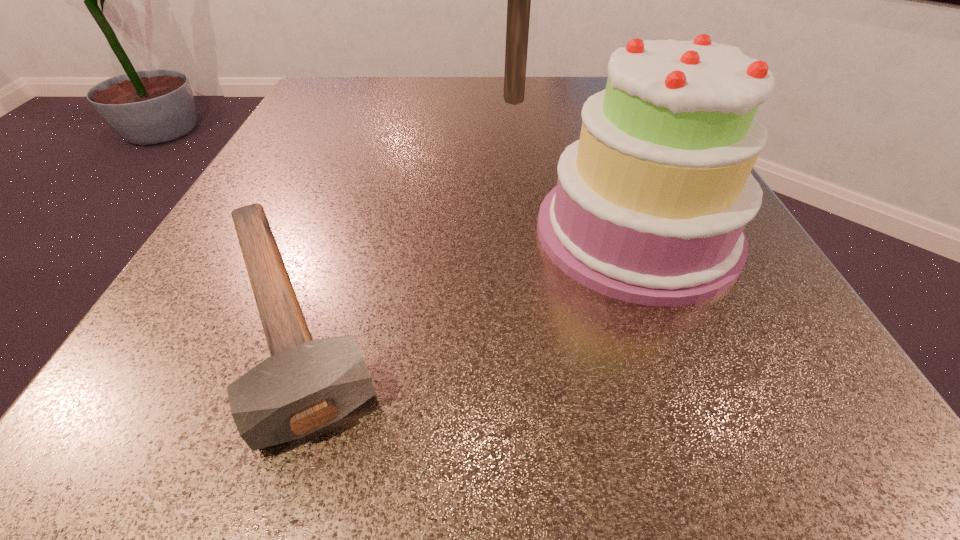
Where is `free space between the second shortest object and the leftmost object`? This screenshot has width=960, height=540. free space between the second shortest object and the leftmost object is located at coordinates click(x=465, y=274).

Find the location of a particular element. free spot between the second shortest object and the nearer mallet is located at coordinates (465, 274).

The image size is (960, 540). Find the location of `unoccupied position between the shortest object and the cake`. unoccupied position between the shortest object and the cake is located at coordinates (465, 274).

Locate an element on the screen. The image size is (960, 540). free space between the farthest object and the left mallet is located at coordinates (x=403, y=207).

Identify the location of vacant region between the left mallet and the cake. The height and width of the screenshot is (540, 960). (465, 274).

What are the coordinates of `empty space that is in between the right mallet and the leftmost object` in the screenshot? It's located at (403, 207).

Image resolution: width=960 pixels, height=540 pixels. I want to click on object that stands as the closest to the tallest object, so click(650, 205).

Identify which object is the second nearest to the leftmost object. Please provide its 2D coordinates. Your answer should be formatted as a tuple, i.e. [(x, y)], where the tuple contains the x and y coordinates of a point satisfying the conditions above.

[(519, 0)]

Find the location of `vacant region that satisfies the following two spatial constraints: 1. on the back side of the cake; 2. on the right side of the nearer mallet`. vacant region that satisfies the following two spatial constraints: 1. on the back side of the cake; 2. on the right side of the nearer mallet is located at coordinates (325, 232).

Identify the location of free spot that satisfies the following two spatial constraints: 1. on the back side of the cake; 2. on the right side of the nearer mallet. The image size is (960, 540). (325, 232).